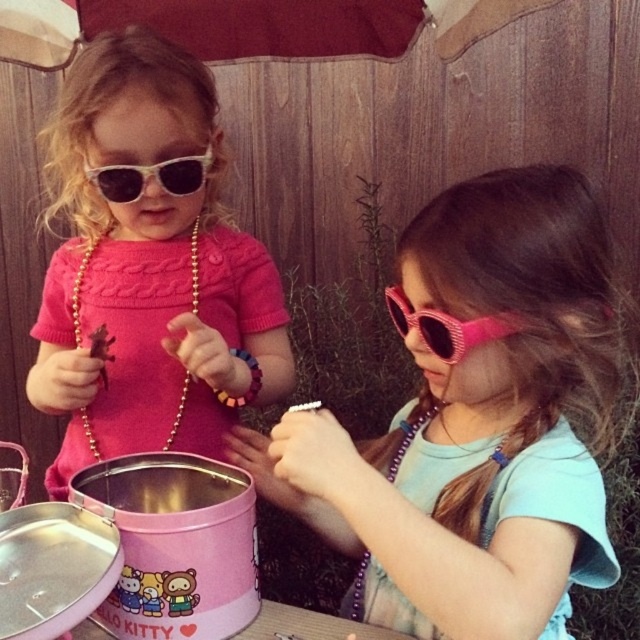
Which is behind, point (436, 568) or point (138, 376)?

Positioned behind is point (138, 376).

Looking at this image, can you confirm if pink matte sunglasses at center is smaller than matte pink sweater at left?

No, pink matte sunglasses at center is not smaller than matte pink sweater at left.

This screenshot has width=640, height=640. In order to click on pink matte sunglasses at center in this screenshot , I will do `click(476, 420)`.

Image resolution: width=640 pixels, height=640 pixels. Find the location of `pink matte sunglasses at center`. pink matte sunglasses at center is located at coordinates (476, 420).

Does point (460, 236) lie in front of point (205, 157)?

Yes, point (460, 236) is closer to viewer.

Is pink matte sunglasses at center wider than white plastic sunglasses at upper left?

Correct, the width of pink matte sunglasses at center exceeds that of white plastic sunglasses at upper left.

Does point (484, 259) lie behind point (156, 172)?

No, (484, 259) is in front of (156, 172).

The width and height of the screenshot is (640, 640). Find the location of `pink matte sunglasses at center`. pink matte sunglasses at center is located at coordinates (476, 420).

Which is in front, point (102, 200) or point (138, 176)?

Point (138, 176) is in front.

This screenshot has height=640, width=640. What are the coordinates of `matte pink sweater at left` in the screenshot? It's located at (148, 264).

You are a GUI agent. You are given a task and a screenshot of the screen. Output one action in this format:
    pyautogui.click(x=<x>, y=<y>)
    Task: Click on the matte pink sweater at left
    This screenshot has width=640, height=640.
    Given the screenshot: What is the action you would take?
    pyautogui.click(x=148, y=264)